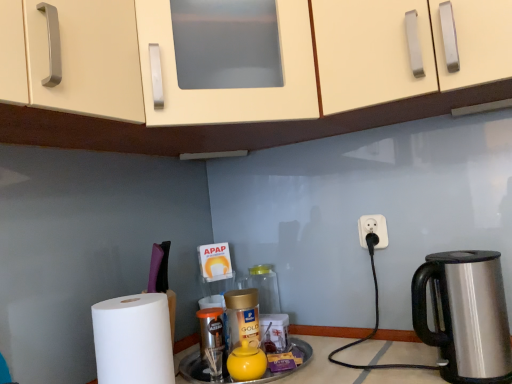
Question: Would you say matte cream cabinet at upper center is part of gold plastic bottle at center, which is the second bottle in back-to-front order,'s contents?

Choices:
 (A) no
 (B) yes

Answer: (A)

Question: Does gold plastic bottle at center, which is the second bottle in back-to-front order, appear on the right side of matte cream cabinet at upper center?

Choices:
 (A) no
 (B) yes

Answer: (A)

Question: Considering the relative sizes of gold plastic bottle at center, which is the second bottle in back-to-front order, and matte cream cabinet at upper center in the image provided, is gold plastic bottle at center, which is the second bottle in back-to-front order, bigger than matte cream cabinet at upper center?

Choices:
 (A) yes
 (B) no

Answer: (B)

Question: Is gold plastic bottle at center, which is the second bottle in back-to-front order, at the left side of matte cream cabinet at upper center?

Choices:
 (A) no
 (B) yes

Answer: (B)

Question: Is gold plastic bottle at center, which ranks as the 1th bottle in front-to-back order, thinner than matte cream cabinet at upper center?

Choices:
 (A) yes
 (B) no

Answer: (A)

Question: From a real-world perspective, is gold plastic bottle at center, which is the second bottle in back-to-front order, below matte cream cabinet at upper center?

Choices:
 (A) no
 (B) yes

Answer: (B)

Question: Would you say white matte paper towel at lower left is outside yellow matte tea pot at center?

Choices:
 (A) no
 (B) yes

Answer: (B)

Question: Is yellow matte tea pot at center surrounded by white matte paper towel at lower left?

Choices:
 (A) yes
 (B) no

Answer: (B)

Question: Can you confirm if white matte paper towel at lower left is positioned to the left of yellow matte tea pot at center?

Choices:
 (A) yes
 (B) no

Answer: (A)

Question: From the image's perspective, does white matte paper towel at lower left appear lower than yellow matte tea pot at center?

Choices:
 (A) no
 (B) yes

Answer: (A)

Question: Does white matte paper towel at lower left come in front of yellow matte tea pot at center?

Choices:
 (A) yes
 (B) no

Answer: (A)

Question: Can you confirm if white matte paper towel at lower left is thinner than yellow matte tea pot at center?

Choices:
 (A) yes
 (B) no

Answer: (B)

Question: Is yellow matte tea pot at center shorter than stainless steel kettle at right?

Choices:
 (A) no
 (B) yes

Answer: (B)